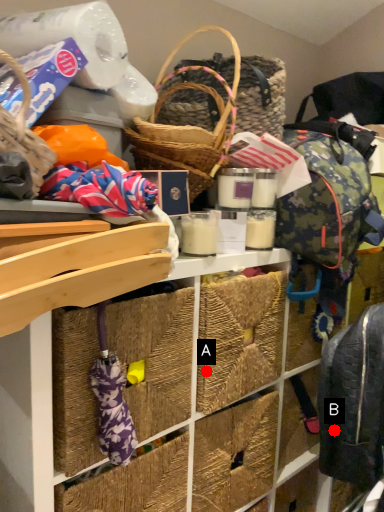
Question: Two points are circled on the image, labeled by A and B beside each circle. Which of the following is the closest to the observer?

Choices:
 (A) A is closer
 (B) B is closer

Answer: (B)